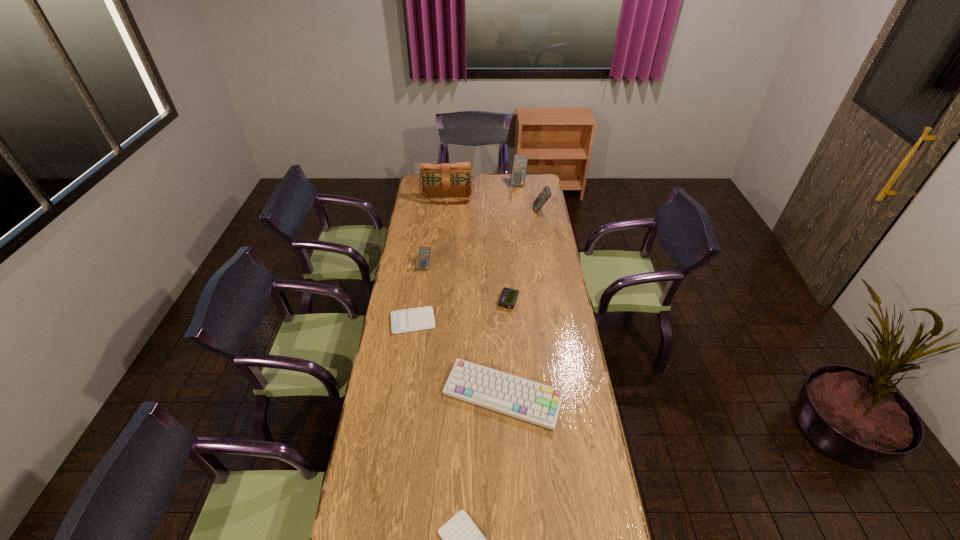
Where is `free point between the third tallest calculator and the second farthest object`? free point between the third tallest calculator and the second farthest object is located at coordinates (437, 233).

Locate an element on the screen. vacant space that's between the seventh nearest object and the farthest calculator is located at coordinates (483, 191).

I want to click on empty space that is in between the third shortest calculator and the second nearest object, so click(464, 332).

Find the location of a particular element. The image size is (960, 540). vacant region between the second farthest object and the second blue calculator from right to left is located at coordinates (483, 191).

The width and height of the screenshot is (960, 540). Identify the location of free space between the sixth tallest object and the third tallest calculator. (467, 284).

Identify which object is located as the third nearest to the seventh farthest object. Please provide its 2D coordinates. Your answer should be formatted as a tuple, i.e. [(x, y)], where the tuple contains the x and y coordinates of a point satisfying the conditions above.

[(508, 297)]

Select which object is the second closest to the fourth tallest object. Please provide its 2D coordinates. Your answer should be formatted as a tuple, i.e. [(x, y)], where the tuple contains the x and y coordinates of a point satisfying the conditions above.

[(508, 297)]

Locate which calculator is the third closest to the fourth farthest calculator. Please provide its 2D coordinates. Your answer should be formatted as a tuple, i.e. [(x, y)], where the tuple contains the x and y coordinates of a point satisfying the conditions above.

[(545, 194)]

The width and height of the screenshot is (960, 540). In order to click on calculator that can be found as the third closest to the fourth tallest calculator in this screenshot , I will do `click(545, 194)`.

I want to click on the closest blue calculator to the beeper, so click(x=424, y=252).